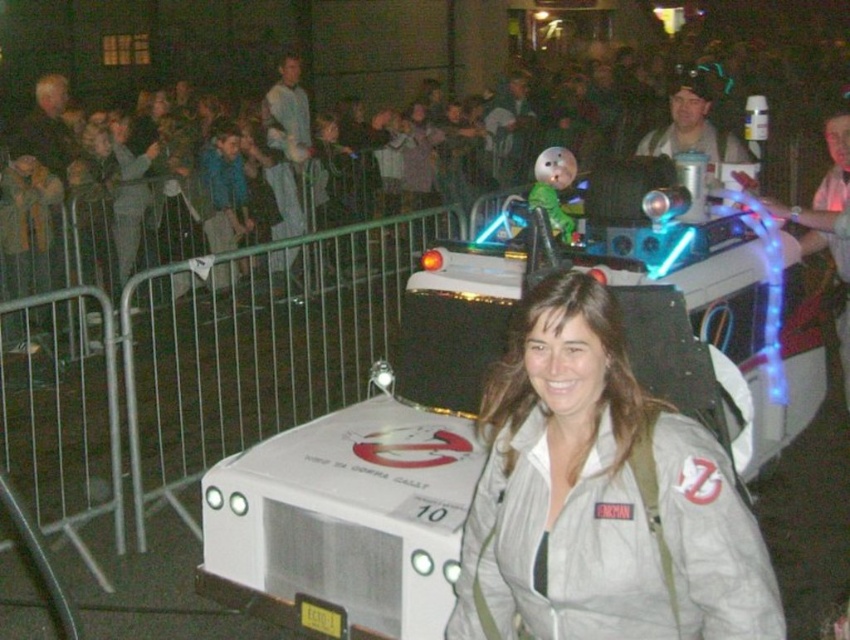
You are at a nighttime event and want to locate the Ghostbusters costume in the crowd. Which object is wider, the dark clothing crowd at upper center or the white matte jacket at center?

The dark clothing crowd at upper center might be wider than the white matte jacket at center.

You are at a parade and want to take a photo of the Ecto 1 vehicle. You notice two points in the scene labeled as point (731, 8) and point (564, 570). Which point is closer to you, the photographer?

Point (731, 8) is closer to you because it is further to the camera than point (564, 570).